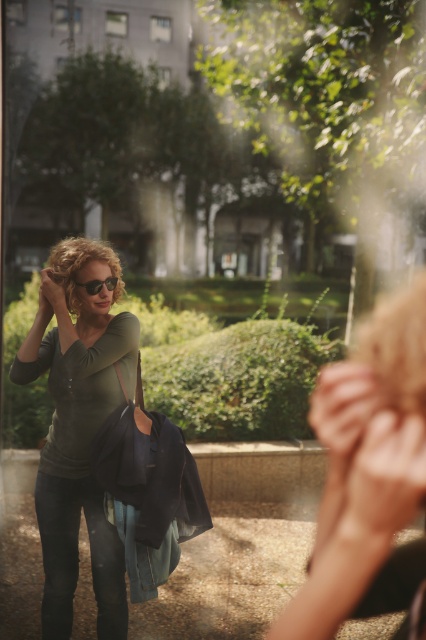
Question: From the image, what is the correct spatial relationship of smooth beige handbag at lower right in relation to matte green shirt at center?

Choices:
 (A) above
 (B) below

Answer: (A)

Question: Which point is closer to the camera taking this photo?

Choices:
 (A) (373, 467)
 (B) (103, 611)
 (C) (83, 284)

Answer: (A)

Question: Which of the following is the farthest from the observer?

Choices:
 (A) (377, 413)
 (B) (112, 280)

Answer: (B)

Question: Is the position of smooth beige handbag at lower right more distant than that of matte black sunglasses at center?

Choices:
 (A) yes
 (B) no

Answer: (B)

Question: Estimate the real-world distances between objects in this image. Which object is farther from the matte green shirt at center?

Choices:
 (A) matte black sunglasses at center
 (B) smooth beige handbag at lower right

Answer: (B)

Question: Does smooth beige handbag at lower right have a larger size compared to matte black sunglasses at center?

Choices:
 (A) yes
 (B) no

Answer: (A)